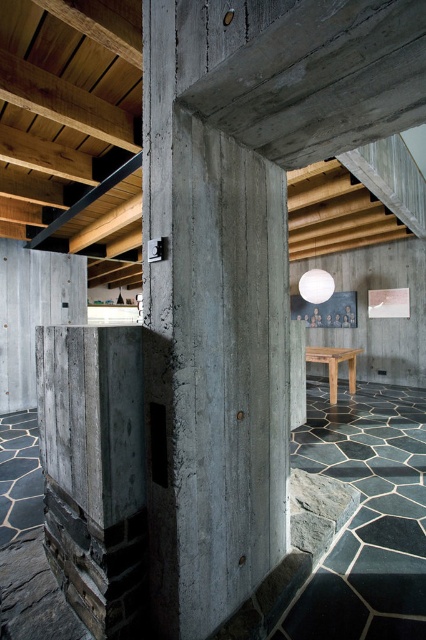
Question: Among these points, which one is farthest from the camera?

Choices:
 (A) (160, 100)
 (B) (316, 294)
 (C) (83, 205)

Answer: (B)

Question: Can you confirm if concrete at center is smaller than white matte sphere at upper center?

Choices:
 (A) yes
 (B) no

Answer: (B)

Question: Is the position of wooden stool at center less distant than that of white matte sphere at upper center?

Choices:
 (A) no
 (B) yes

Answer: (B)

Question: Which is farther from the wooden stool at center?

Choices:
 (A) concrete at center
 (B) white matte sphere at upper center

Answer: (A)

Question: Among these objects, which one is farthest from the camera?

Choices:
 (A) wooden stool at center
 (B) white matte sphere at upper center

Answer: (B)

Question: Can you confirm if concrete at center is smaller than wooden stool at center?

Choices:
 (A) yes
 (B) no

Answer: (B)